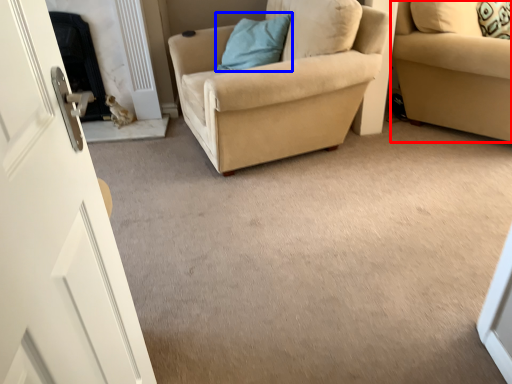
Question: Among these objects, which one is farthest to the camera, studio couch (highlighted by a red box) or pillow (highlighted by a blue box)?

Choices:
 (A) studio couch
 (B) pillow

Answer: (B)